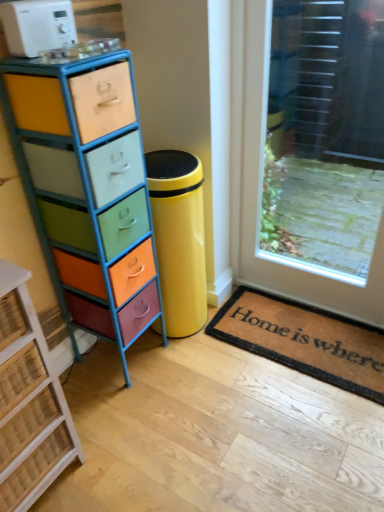
The width and height of the screenshot is (384, 512). In order to click on vacant space that's between rustic wicker chest of drawers at left, the second chest of drawers from the right, and brown coir mat at lower right in this screenshot , I will do 195,414.